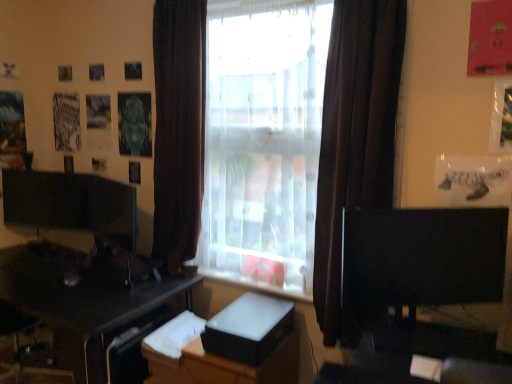
Question: From the image's perspective, is white glossy dresser at center under translucent fabric window at center?

Choices:
 (A) yes
 (B) no

Answer: (A)

Question: Considering the relative sizes of white glossy dresser at center and translucent fabric window at center in the image provided, is white glossy dresser at center shorter than translucent fabric window at center?

Choices:
 (A) no
 (B) yes

Answer: (B)

Question: Can you confirm if white glossy dresser at center is positioned to the right of translucent fabric window at center?

Choices:
 (A) no
 (B) yes

Answer: (A)

Question: Is white glossy dresser at center completely or partially outside of translucent fabric window at center?

Choices:
 (A) no
 (B) yes

Answer: (B)

Question: Is white glossy dresser at center thinner than translucent fabric window at center?

Choices:
 (A) no
 (B) yes

Answer: (A)

Question: In terms of height, does matte black monitor at left, arranged as the second computer monitor when viewed from the right, look taller or shorter compared to brown fabric curtain at center, which ranks as the 1th curtain in left-to-right order?

Choices:
 (A) short
 (B) tall

Answer: (A)

Question: From a real-world perspective, relative to brown fabric curtain at center, which appears as the 2th curtain when viewed from the right, is matte black monitor at left, marked as the second computer monitor in a front-to-back arrangement, vertically above or below?

Choices:
 (A) above
 (B) below

Answer: (B)

Question: Considering the positions of matte black monitor at left, which ranks as the 1th computer monitor in back-to-front order, and brown fabric curtain at center, which ranks as the 1th curtain in left-to-right order, in the image, is matte black monitor at left, which ranks as the 1th computer monitor in back-to-front order, bigger or smaller than brown fabric curtain at center, which ranks as the 1th curtain in left-to-right order,?

Choices:
 (A) big
 (B) small

Answer: (B)

Question: Considering the positions of point (93, 206) and point (157, 215), is point (93, 206) closer or farther from the camera than point (157, 215)?

Choices:
 (A) farther
 (B) closer

Answer: (A)

Question: Considering the positions of translucent fabric window at center and black glossy desk at lower left in the image, is translucent fabric window at center taller or shorter than black glossy desk at lower left?

Choices:
 (A) tall
 (B) short

Answer: (A)

Question: Looking at their shapes, would you say translucent fabric window at center is wider or thinner than black glossy desk at lower left?

Choices:
 (A) wide
 (B) thin

Answer: (B)

Question: In terms of size, does translucent fabric window at center appear bigger or smaller than black glossy desk at lower left?

Choices:
 (A) big
 (B) small

Answer: (B)

Question: Is translucent fabric window at center spatially inside black glossy desk at lower left, or outside of it?

Choices:
 (A) outside
 (B) inside

Answer: (A)

Question: Is black glossy desk at lower left taller or shorter than white glossy dresser at center?

Choices:
 (A) short
 (B) tall

Answer: (B)

Question: From the image's perspective, is black glossy desk at lower left above or below white glossy dresser at center?

Choices:
 (A) below
 (B) above

Answer: (B)